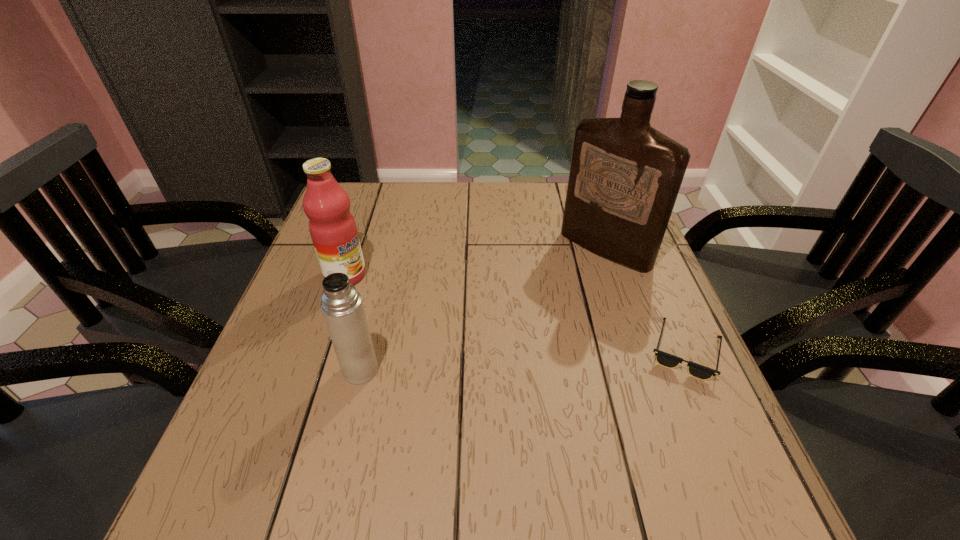
Image resolution: width=960 pixels, height=540 pixels. Find the location of `free space on the desktop that is between the thermos bottle and the sunglasses and is positioned on the label side of the liquor`. free space on the desktop that is between the thermos bottle and the sunglasses and is positioned on the label side of the liquor is located at coordinates (483, 363).

Where is `free space on the desktop that is between the thermos bottle and the sunglasses and is positioned on the label of the second tallest object`? free space on the desktop that is between the thermos bottle and the sunglasses and is positioned on the label of the second tallest object is located at coordinates (487, 362).